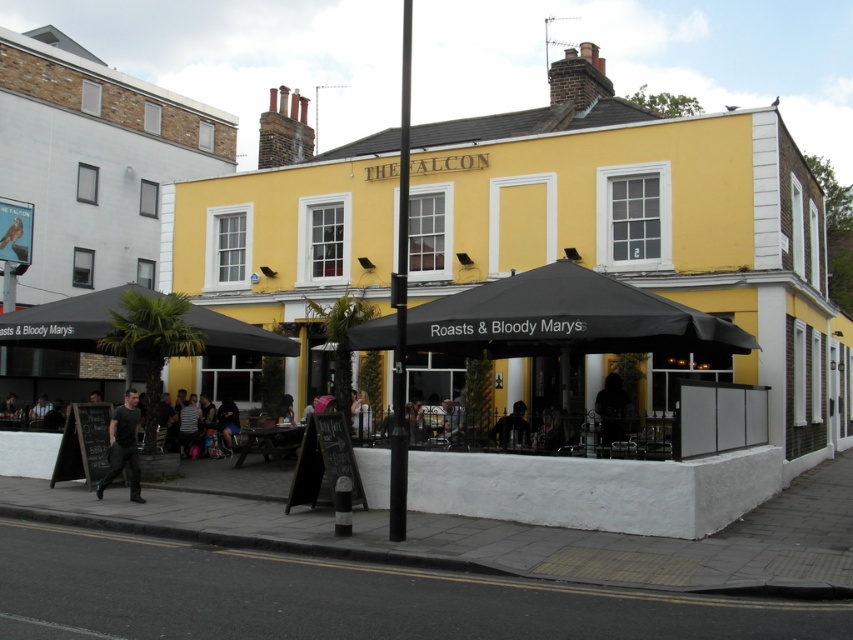
Question: Where is black fabric umbrella at left located in relation to black matte shirt at center in the image?

Choices:
 (A) below
 (B) above

Answer: (B)

Question: Estimate the real-world distances between objects in this image. Which object is farther from the striped shirt at center?

Choices:
 (A) black matte shirt at center
 (B) black fabric umbrella at left
 (C) dark fabric figure at center

Answer: (C)

Question: Is black fabric canopy at center behind striped shirt at center?

Choices:
 (A) yes
 (B) no

Answer: (B)

Question: Does black fabric umbrella at left appear on the left side of dark brown hair at center?

Choices:
 (A) no
 (B) yes

Answer: (B)

Question: Which is nearer to the black fabric umbrella at left?

Choices:
 (A) black fabric canopy at center
 (B) black matte shirt at center

Answer: (B)

Question: Which point is farther to the camera?

Choices:
 (A) [99, 323]
 (B) [235, 410]
 (C) [587, 333]
 (D) [508, 432]

Answer: (B)